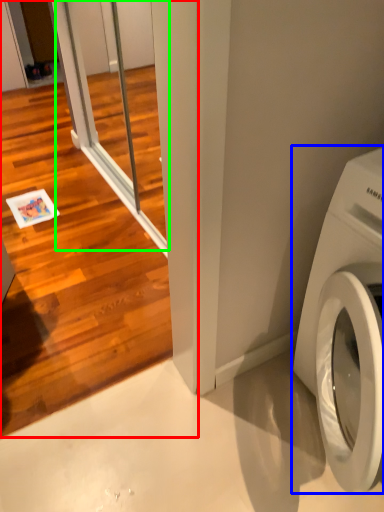
Question: Estimate the real-world distances between objects in this image. Which object is closer to screen door (highlighted by a red box), washing machine (highlighted by a blue box) or screen door (highlighted by a green box)?

Choices:
 (A) washing machine
 (B) screen door

Answer: (B)